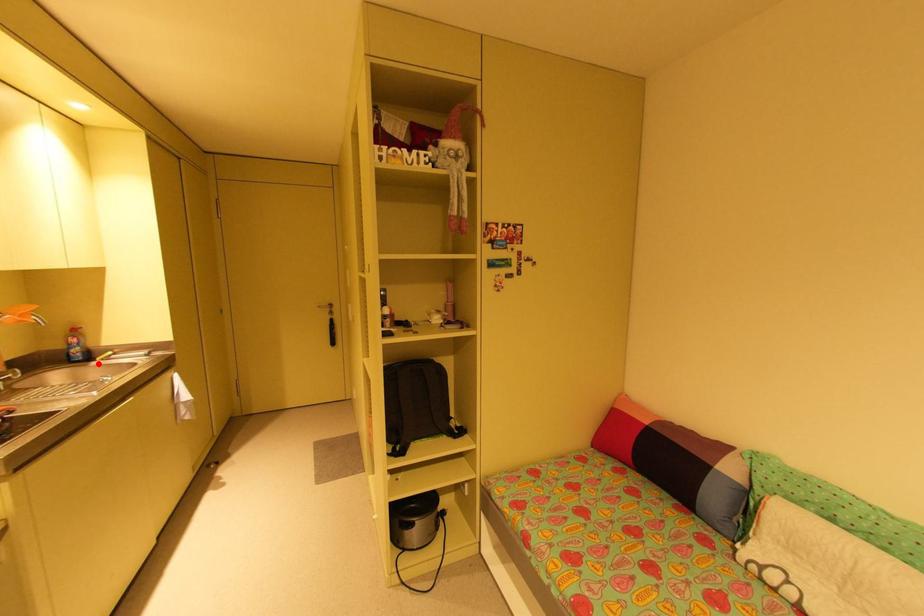
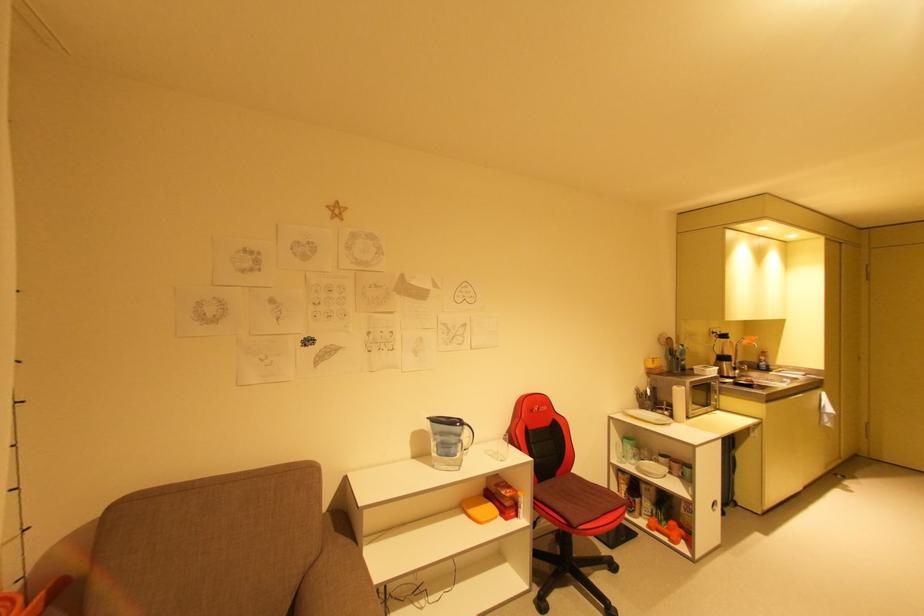
Where in the second image is the point corresponding to the highlighted location from the first image?

(776, 373)